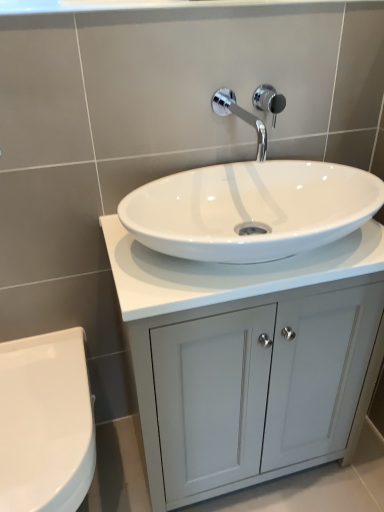
Question: Is chrome metallic shower at upper center to the left or to the right of white glossy countertop at center in the image?

Choices:
 (A) right
 (B) left

Answer: (A)

Question: Looking at the image, does chrome metallic shower at upper center seem bigger or smaller compared to white glossy countertop at center?

Choices:
 (A) small
 (B) big

Answer: (A)

Question: Estimate the real-world distances between objects in this image. Which object is closer to the white glossy countertop at center?

Choices:
 (A) white glossy toilet at lower left
 (B) chrome metallic shower at upper center
 (C) chrome metallic faucet at upper center
 (D) white glossy cabinet at center

Answer: (D)

Question: Which is nearer to the chrome metallic shower at upper center?

Choices:
 (A) chrome metallic faucet at upper center
 (B) white glossy cabinet at center
 (C) white glossy toilet at lower left
 (D) white glossy countertop at center

Answer: (A)